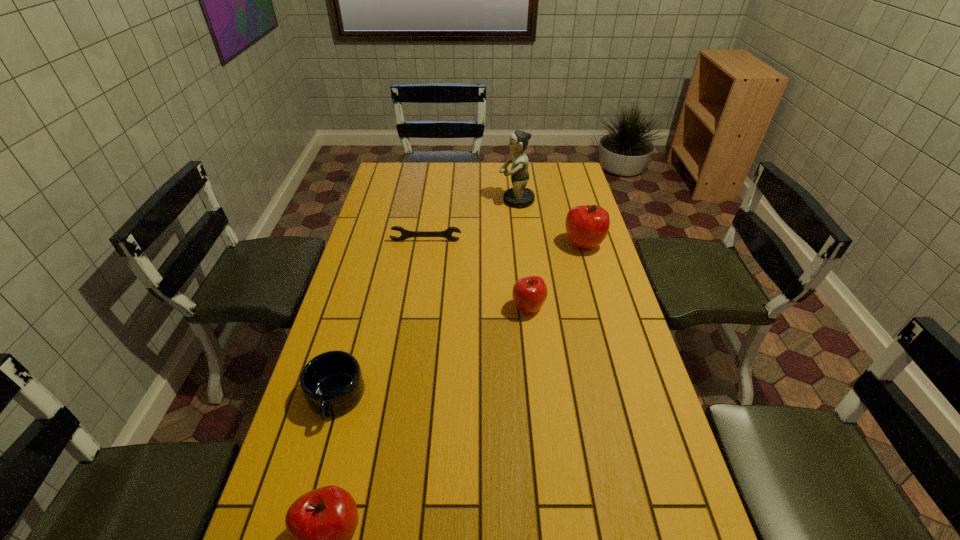
Please mark a free spot for a new apple to balance the arrangement. Please provide its 2D coordinates. Your answer should be formatted as a tuple, i.e. [(x, y)], where the tuple contains the x and y coordinates of a point satisfying the conditions above.

[(450, 397)]